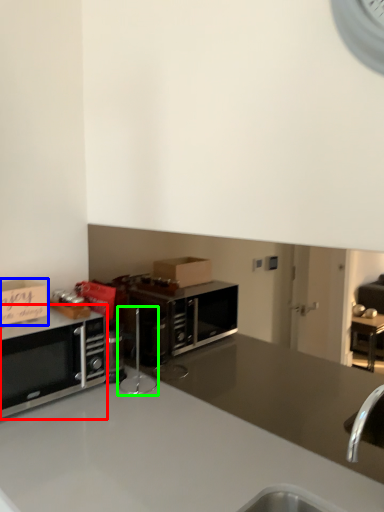
Question: Estimate the real-world distances between objects in this image. Which object is farther from microwave oven (highlighted by a red box), cabinetry (highlighted by a blue box) or appliance (highlighted by a green box)?

Choices:
 (A) cabinetry
 (B) appliance

Answer: (B)